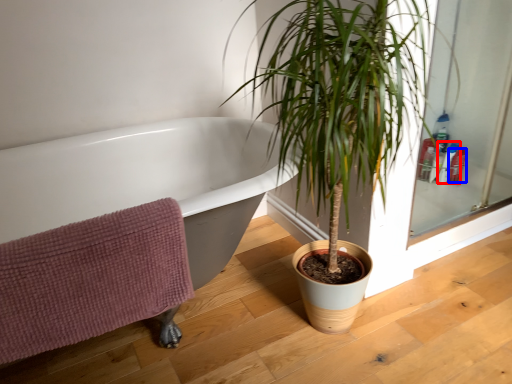
Question: Which of the following is the closest to the observer, toiletry (highlighted by a red box) or toiletry (highlighted by a blue box)?

Choices:
 (A) toiletry
 (B) toiletry

Answer: (A)